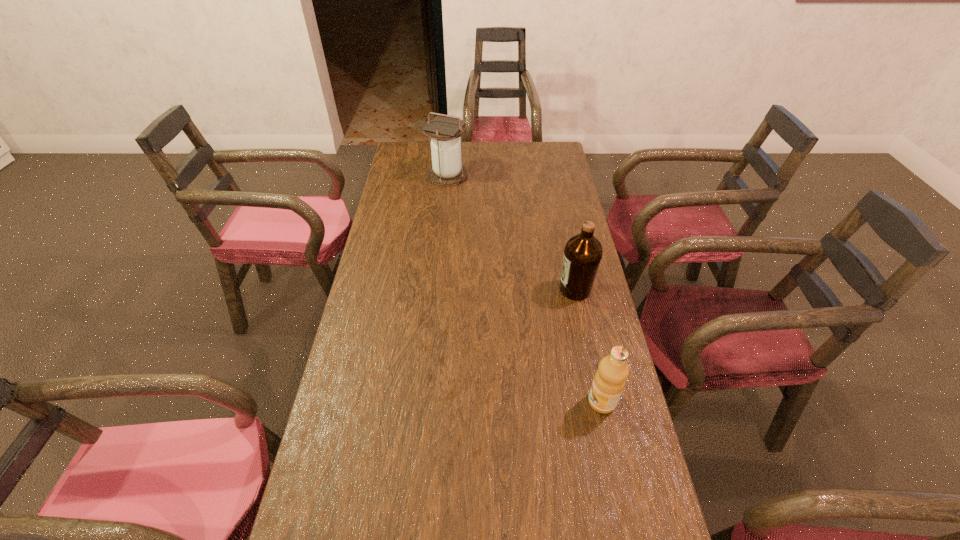
Identify the location of the farthest object. (447, 169).

Locate an element on the screen. lantern is located at coordinates 447,169.

Where is `the farther olive oil`? the farther olive oil is located at coordinates pyautogui.click(x=582, y=255).

The height and width of the screenshot is (540, 960). Identify the location of the taller olive oil. (582, 255).

This screenshot has width=960, height=540. Identify the location of the nearer olive oil. (609, 381).

Find the location of a particular element. The height and width of the screenshot is (540, 960). the shortest object is located at coordinates [x=609, y=381].

At what (x,y) coordinates should I click in order to perform the action: click on vacant space positioned on the right of the farthest object. Please return your answer as a coordinate pair (x, y). The height and width of the screenshot is (540, 960). Looking at the image, I should click on (490, 176).

You are a GUI agent. You are given a task and a screenshot of the screen. Output one action in this format:
    pyautogui.click(x=<x>, y=<y>)
    Task: Click on the vacant region located 0.390m on the label of the farther olive oil
    The height and width of the screenshot is (540, 960).
    Given the screenshot: What is the action you would take?
    pyautogui.click(x=433, y=289)

The width and height of the screenshot is (960, 540). I want to click on blank area located on the label of the farther olive oil, so click(x=535, y=289).

Image resolution: width=960 pixels, height=540 pixels. I want to click on vacant point located on the label of the farther olive oil, so click(x=484, y=289).